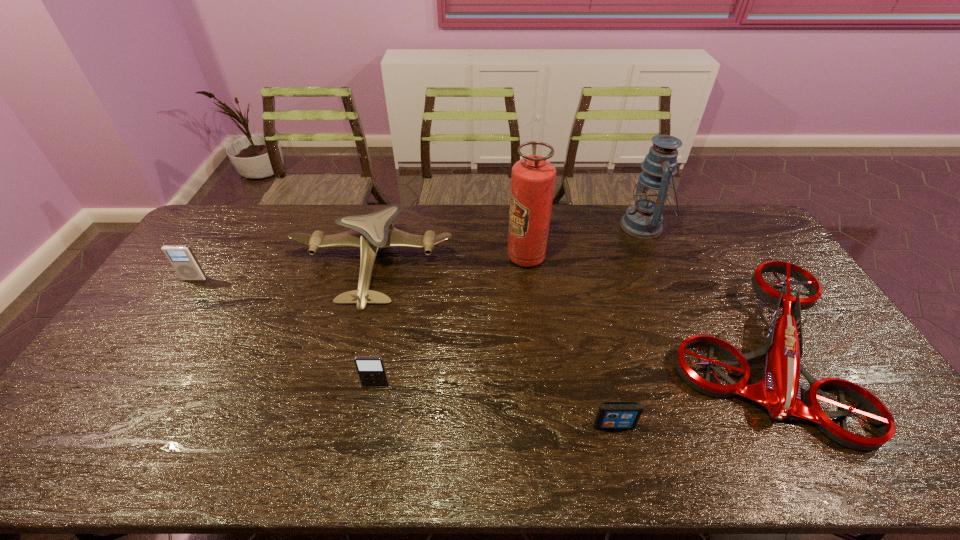
At what (x,y) coordinates should I click in order to perform the action: click on vacant space located 0.190m on the label side of the fourth object from left to right. Please return your answer as a coordinate pair (x, y). The image size is (960, 540). Looking at the image, I should click on (452, 256).

Where is `free location located on the label side of the fourth object from left to right`? The image size is (960, 540). free location located on the label side of the fourth object from left to right is located at coordinates (406, 256).

The height and width of the screenshot is (540, 960). In order to click on free space located on the label side of the fourth object from left to right in this screenshot , I will do `click(409, 256)`.

Locate an element on the screen. vacant area located 0.340m on the front-facing side of the lantern is located at coordinates (530, 226).

In order to click on free space located on the front-facing side of the lantern in this screenshot , I will do `click(563, 226)`.

The width and height of the screenshot is (960, 540). I want to click on vacant space located on the front-facing side of the lantern, so click(560, 226).

The height and width of the screenshot is (540, 960). I want to click on vacant space located on the front-facing side of the leftmost object, so click(x=135, y=369).

You are a GUI agent. You are given a task and a screenshot of the screen. Output one action in this format:
    pyautogui.click(x=<x>, y=<y>)
    Task: Click on the vacant region located 0.170m on the front-facing side of the left drone
    
    Given the screenshot: What is the action you would take?
    click(x=348, y=356)

Locate an element on the screen. blank space located on the front-facing side of the second iPod from right to left is located at coordinates pos(364,445).

What are the coordinates of `vacant area situated on the back of the right drone` in the screenshot? It's located at (686, 228).